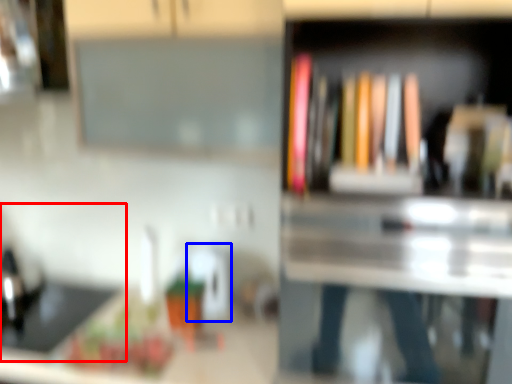
Question: Which point is closer to the camera, sink (highlighted by a red box) or appliance (highlighted by a blue box)?

Choices:
 (A) sink
 (B) appliance

Answer: (A)